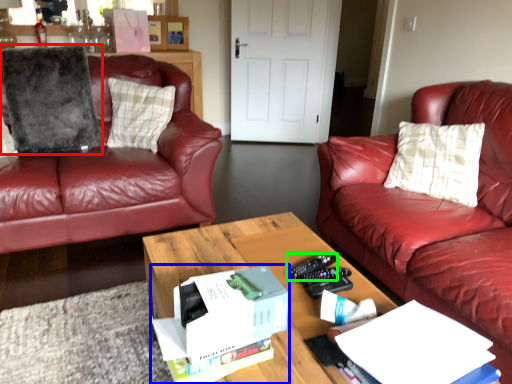
Question: Which is farther away from pillow (highlighted by a red box)? box (highlighted by a blue box) or remote control (highlighted by a green box)?

Choices:
 (A) box
 (B) remote control

Answer: (A)